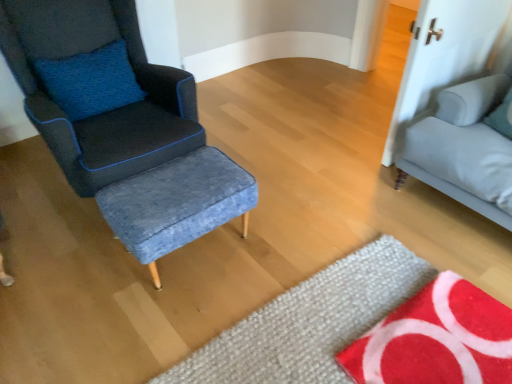
Where is `vacant area that is in front of matte blue fabric chair at left`? The image size is (512, 384). vacant area that is in front of matte blue fabric chair at left is located at coordinates (91, 293).